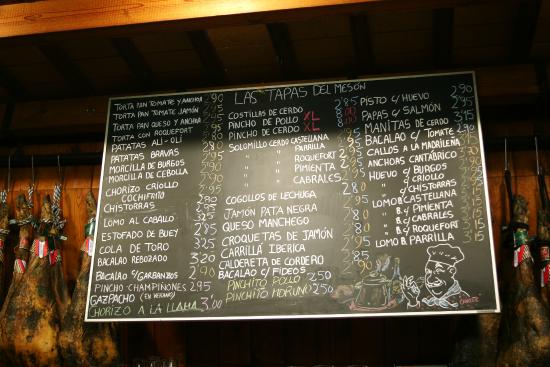
Locate an element on the screen. The height and width of the screenshot is (367, 550). nails/hooks is located at coordinates (8, 176), (31, 174), (58, 167), (505, 156), (537, 153), (90, 170).